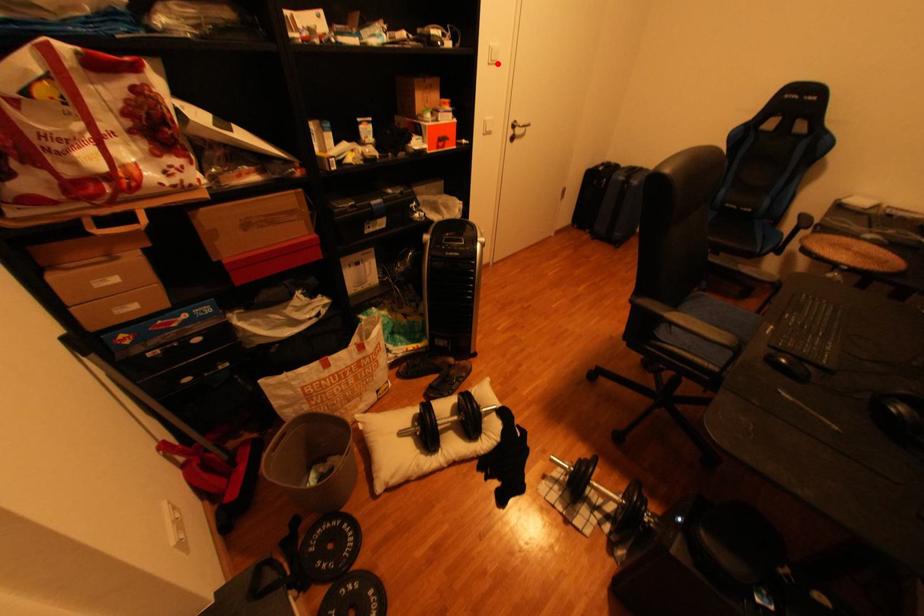
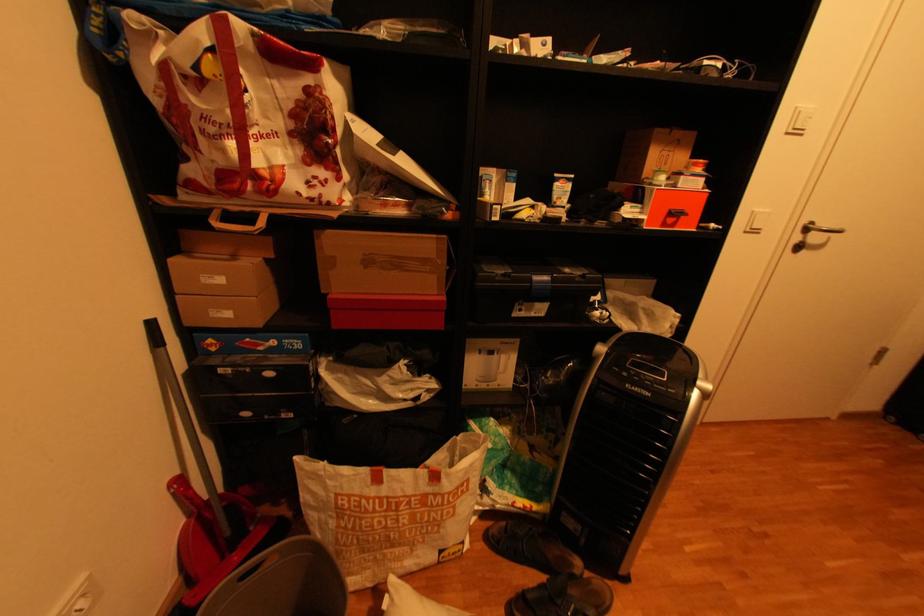
Find the pixel in the second image that matches the highlighted location in the first image.

(796, 134)